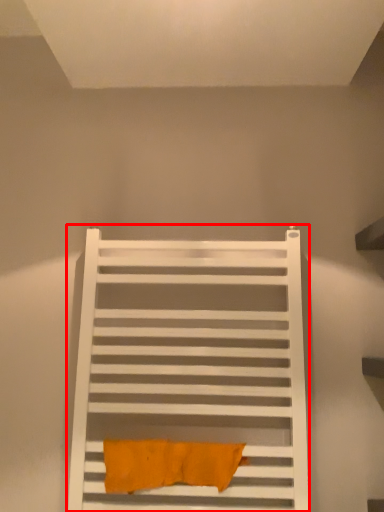
Question: From the image's perspective, what is the correct spatial positioning of furniture (annotated by the red box) in reference to bath towel?

Choices:
 (A) above
 (B) below

Answer: (A)